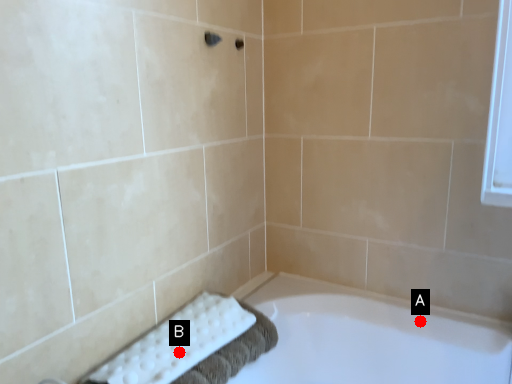
Question: Two points are circled on the image, labeled by A and B beside each circle. Which of the following is the closest to the observer?

Choices:
 (A) A is closer
 (B) B is closer

Answer: (B)